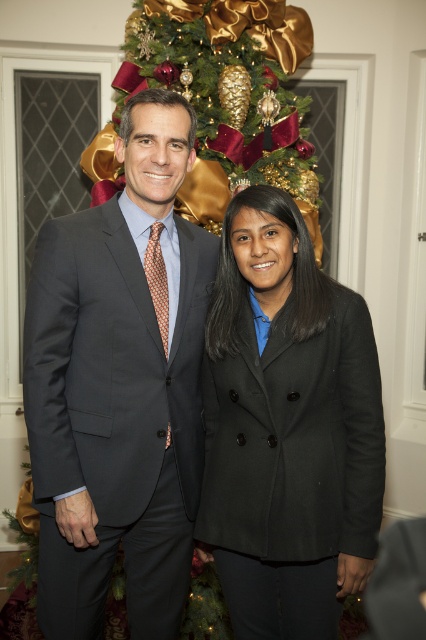
From the picture: You are at a festive event and want to take a photo of the black wool coat at center and the green textured christmas tree at upper center. Which object is closer to the camera?

The black wool coat at center is closer to the camera since it is located below the green textured christmas tree at upper center, implying it is positioned lower in the scene and thus nearer to the viewer.

You are standing in the same room as the matte gray suit at center. If you want to greet someone who is 6 feet tall, can you comfortably shake hands with them while standing at your current position?

The matte gray suit at center is 5.07 feet away from the viewer. Since the average handshake distance is about 2.5 feet, you can comfortably shake hands with someone 6 feet tall from your current position as the distance is sufficient.

You are a photographer setting up for a group photo. You need to ensure that the matte gray suit at center and the green textured christmas tree at upper center are both visible in the frame. Based on their positions, which object should you focus on first to ensure both are in focus?

The matte gray suit at center is in front of the green textured christmas tree at upper center, so you should focus on the matte gray suit at center first. This way, both objects will be in focus since the tree is behind it.